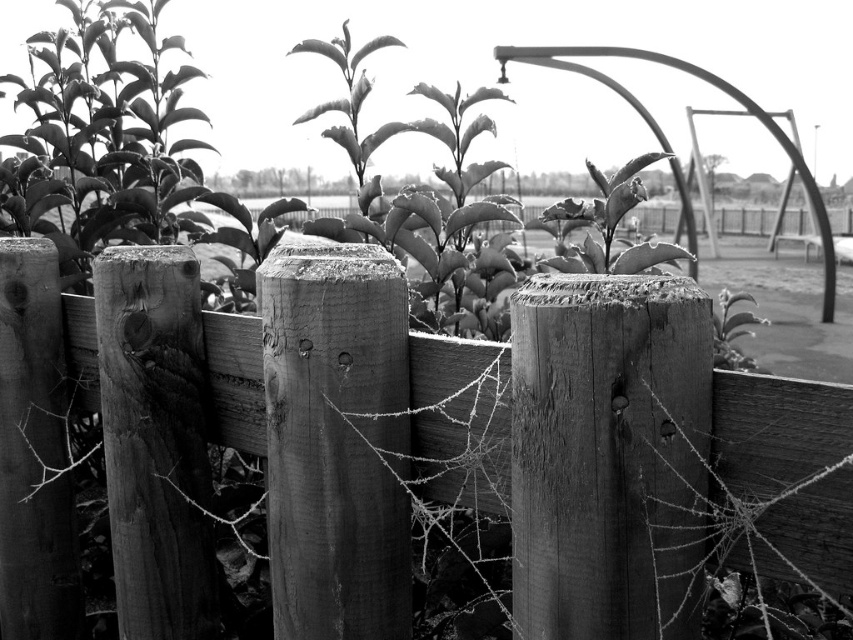
Is wooden fence at center positioned behind smooth green leaf at center?

No, it is not.

Based on the photo, is wooden fence at center to the left of smooth green leaf at center from the viewer's perspective?

Indeed, wooden fence at center is positioned on the left side of smooth green leaf at center.

Between point (251, 381) and point (601, 212), which one is positioned behind?

Positioned behind is point (601, 212).

Where is `wooden fence at center`? The height and width of the screenshot is (640, 853). wooden fence at center is located at coordinates (250, 428).